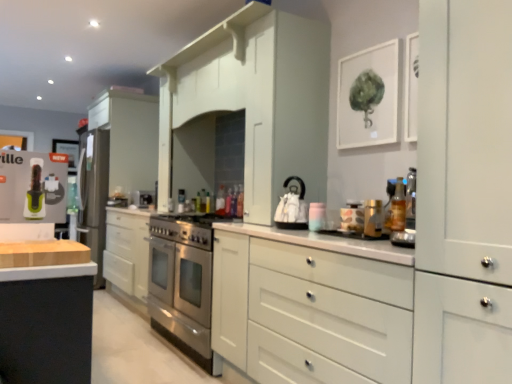
Question: Does wooden at left have a larger size compared to satin silver refrigerator at left, the 1th appliance viewed from the back?

Choices:
 (A) no
 (B) yes

Answer: (A)

Question: Considering the relative positions of wooden at left and satin silver refrigerator at left, the fourth appliance viewed from the right, in the image provided, is wooden at left behind satin silver refrigerator at left, the fourth appliance viewed from the right,?

Choices:
 (A) no
 (B) yes

Answer: (A)

Question: From a real-world perspective, is wooden at left located beneath satin silver refrigerator at left, the fourth appliance viewed from the right?

Choices:
 (A) yes
 (B) no

Answer: (A)

Question: Is wooden at left looking in the opposite direction of satin silver refrigerator at left, the fourth appliance viewed from the right?

Choices:
 (A) yes
 (B) no

Answer: (B)

Question: Does wooden at left come in front of satin silver refrigerator at left, the 1th appliance viewed from the back?

Choices:
 (A) no
 (B) yes

Answer: (B)

Question: Is stainless steel gas stove at center taller or shorter than white matte cabinet at center?

Choices:
 (A) tall
 (B) short

Answer: (B)

Question: Relative to white matte cabinet at center, is stainless steel gas stove at center in front or behind?

Choices:
 (A) behind
 (B) front

Answer: (A)

Question: From the image's perspective, is stainless steel gas stove at center located above or below white matte cabinet at center?

Choices:
 (A) below
 (B) above

Answer: (B)

Question: Visually, is stainless steel gas stove at center positioned to the left or to the right of white matte cabinet at center?

Choices:
 (A) right
 (B) left

Answer: (B)

Question: Relative to satin silver refrigerator at left, which is the fourth appliance in front-to-back order, is matte white jar at center, the fourth appliance viewed from the back, in front or behind?

Choices:
 (A) behind
 (B) front

Answer: (B)

Question: Considering the positions of matte white jar at center, the fourth appliance viewed from the back, and satin silver refrigerator at left, which is the fourth appliance in front-to-back order, in the image, is matte white jar at center, the fourth appliance viewed from the back, taller or shorter than satin silver refrigerator at left, which is the fourth appliance in front-to-back order,?

Choices:
 (A) tall
 (B) short

Answer: (B)

Question: In terms of width, does matte white jar at center, marked as the 1th appliance in a front-to-back arrangement, look wider or thinner when compared to satin silver refrigerator at left, the fourth appliance viewed from the right?

Choices:
 (A) wide
 (B) thin

Answer: (B)

Question: From the image's perspective, is matte white jar at center, the first appliance when ordered from right to left, positioned above or below satin silver refrigerator at left, which is the fourth appliance in front-to-back order?

Choices:
 (A) below
 (B) above

Answer: (B)

Question: Is matte white jar at center, marked as the 1th appliance in a front-to-back arrangement, in front of or behind white glossy kettle at center, the 2th appliance in the front-to-back sequence, in the image?

Choices:
 (A) front
 (B) behind

Answer: (A)

Question: From a real-world perspective, is matte white jar at center, marked as the 1th appliance in a front-to-back arrangement, positioned above or below white glossy kettle at center, the 2th appliance in the front-to-back sequence?

Choices:
 (A) above
 (B) below

Answer: (B)